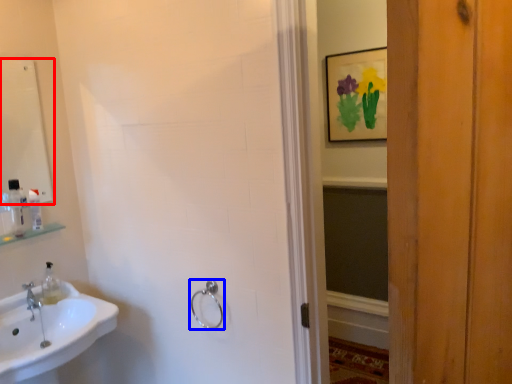
Question: Which point is closer to the camera, mirror (highlighted by a red box) or towel rack (highlighted by a blue box)?

Choices:
 (A) mirror
 (B) towel rack

Answer: (B)